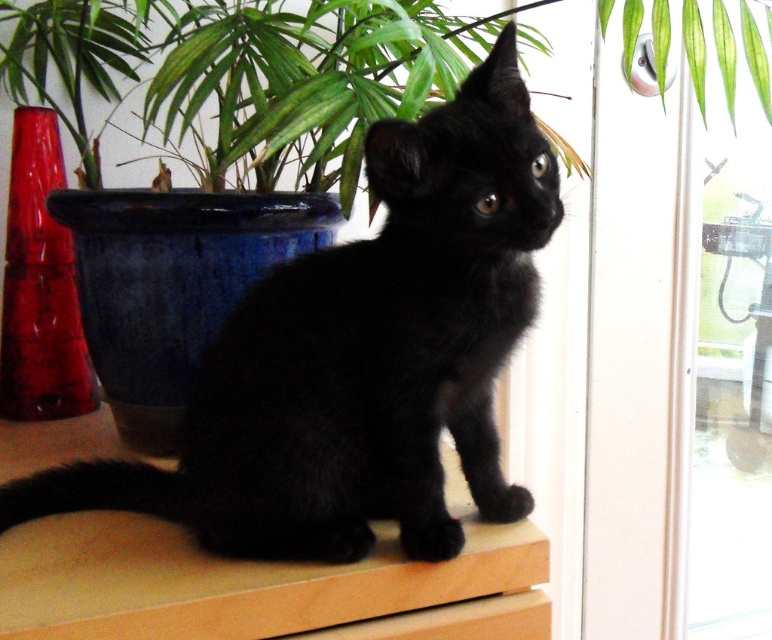
Is point (327, 321) closer to camera compared to point (245, 109)?

Yes, point (327, 321) is closer to viewer.

Who is positioned more to the left, black matte fur cat at center or glossy ceramic pot at upper center?

glossy ceramic pot at upper center is more to the left.

Is point (303, 486) farther from viewer compared to point (85, 140)?

No, it is in front of (85, 140).

The width and height of the screenshot is (772, 640). In order to click on black matte fur cat at center in this screenshot , I will do [x=361, y=356].